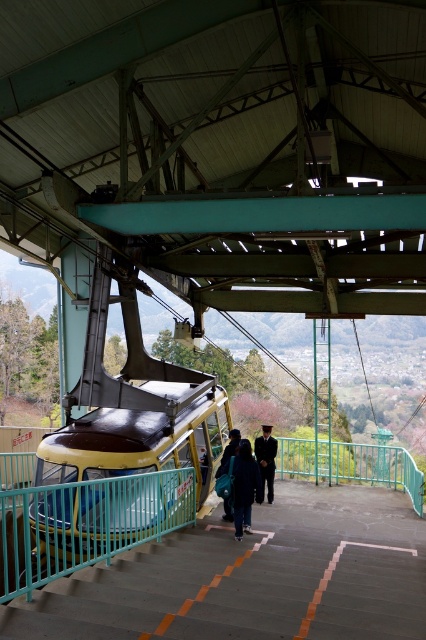
A person is standing at the cable car station and notices two individuals wearing different attire. They see a black suit at center and a dark blue uniform at center. Which of these two outfits has a greater width?

The black suit at center has a greater width than the dark blue uniform at center according to the description.

You are a passenger at the cable car station and you see a person wearing both the dark blue fabric jacket at center and the black suit at center. Which piece of clothing is visible on top?

The dark blue fabric jacket at center is positioned over the black suit at center, so the dark blue fabric jacket at center is visible on top.